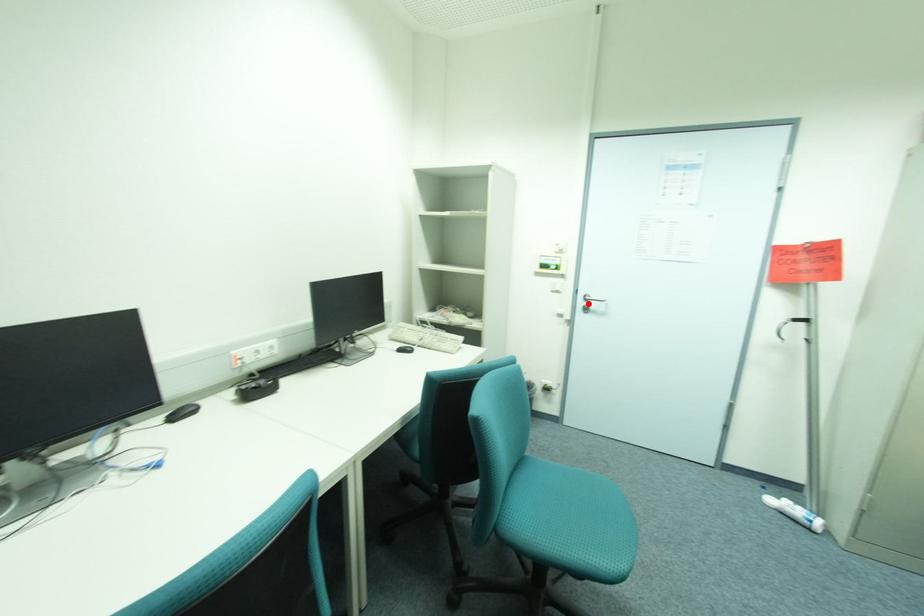
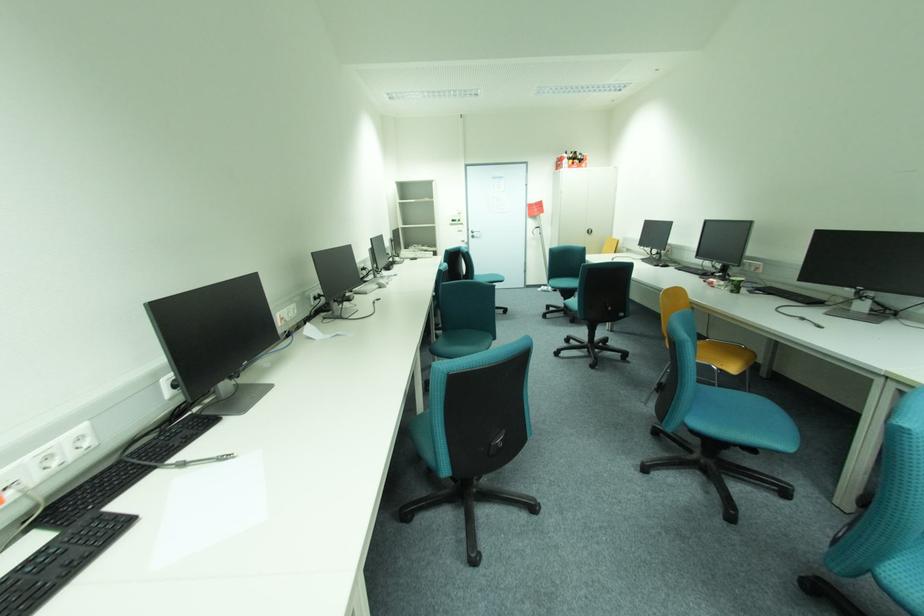
Where in the second image is the point corresponding to the highlighted location from the first image?

(477, 235)